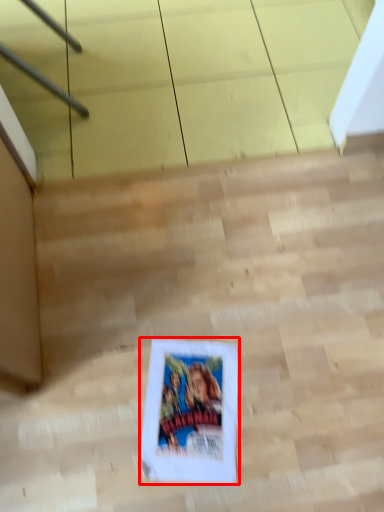
Question: From the image, what is the correct spatial relationship of comic book (annotated by the red box) in relation to stairwell?

Choices:
 (A) left
 (B) right

Answer: (A)